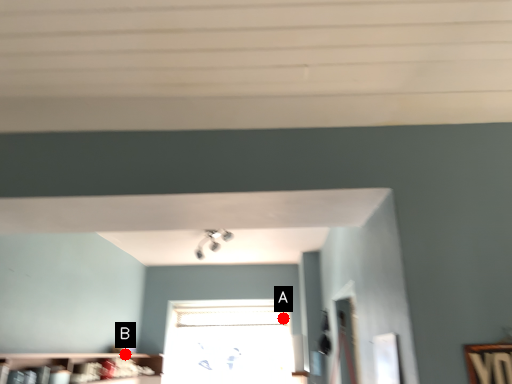
Question: Two points are circled on the image, labeled by A and B beside each circle. Which of the following is the closest to the observer?

Choices:
 (A) A is closer
 (B) B is closer

Answer: (B)